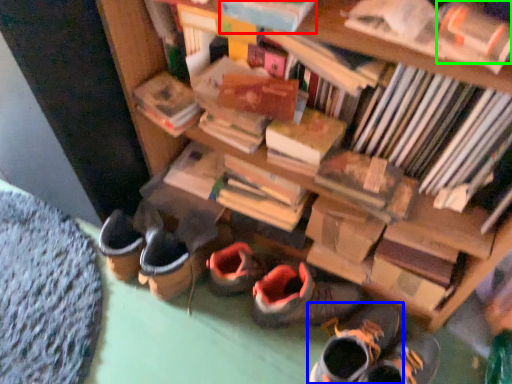
Question: Which object is the closest to the book (highlighted by a red box)? Choose among these: footwear (highlighted by a blue box) or book (highlighted by a green box).

Choices:
 (A) footwear
 (B) book

Answer: (B)